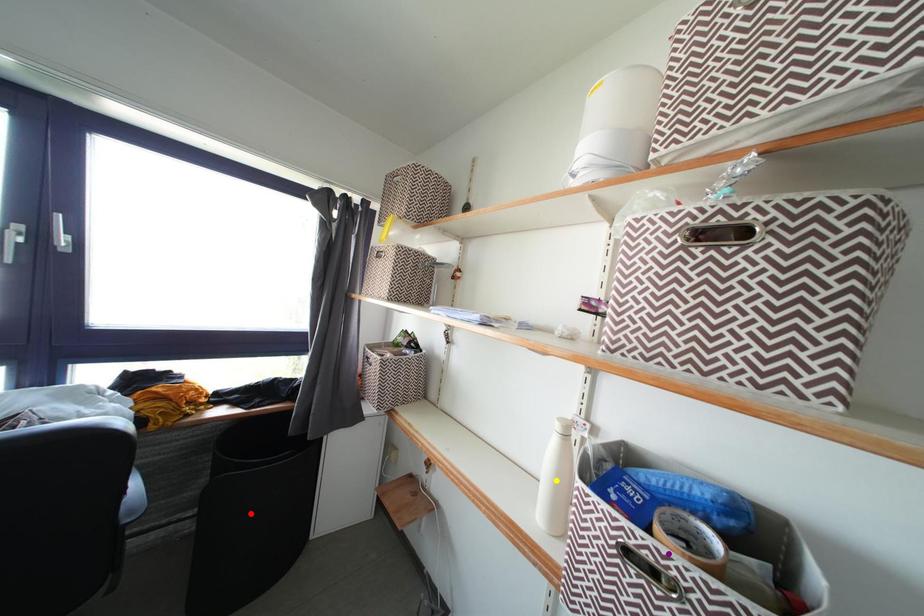
Order these from nearest to farthest:
yellow point | purple point | red point

purple point < yellow point < red point